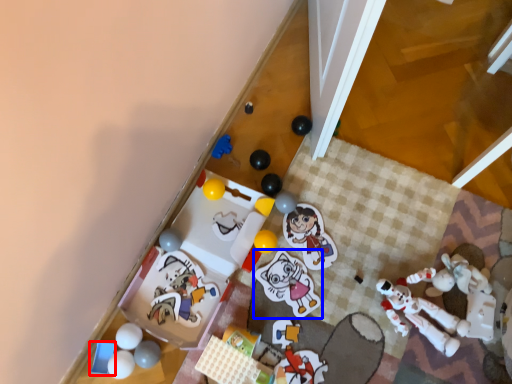
Question: Which object appears closest to the camera in this image, toy (highlighted by a red box) or toy (highlighted by a blue box)?

Choices:
 (A) toy
 (B) toy

Answer: (A)